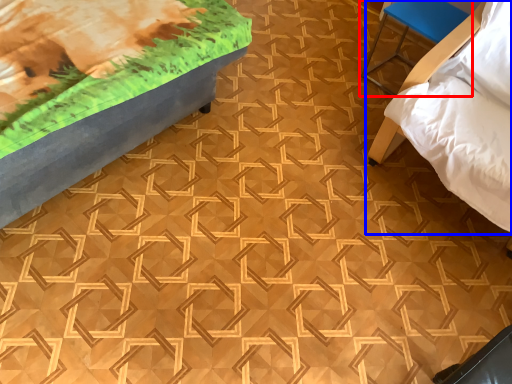
Question: Which point is further to the camera, furniture (highlighted by a red box) or furniture (highlighted by a blue box)?

Choices:
 (A) furniture
 (B) furniture

Answer: (A)